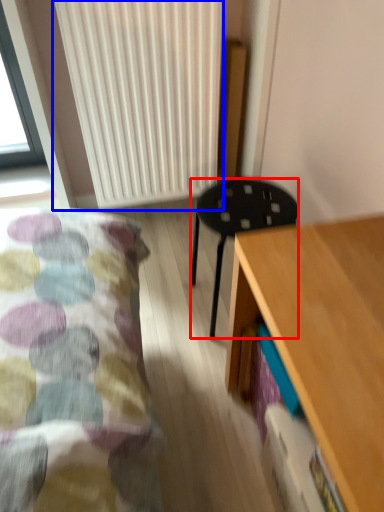
Question: Which object is further to the camera taking this photo, stool (highlighted by a red box) or radiator (highlighted by a blue box)?

Choices:
 (A) stool
 (B) radiator

Answer: (B)